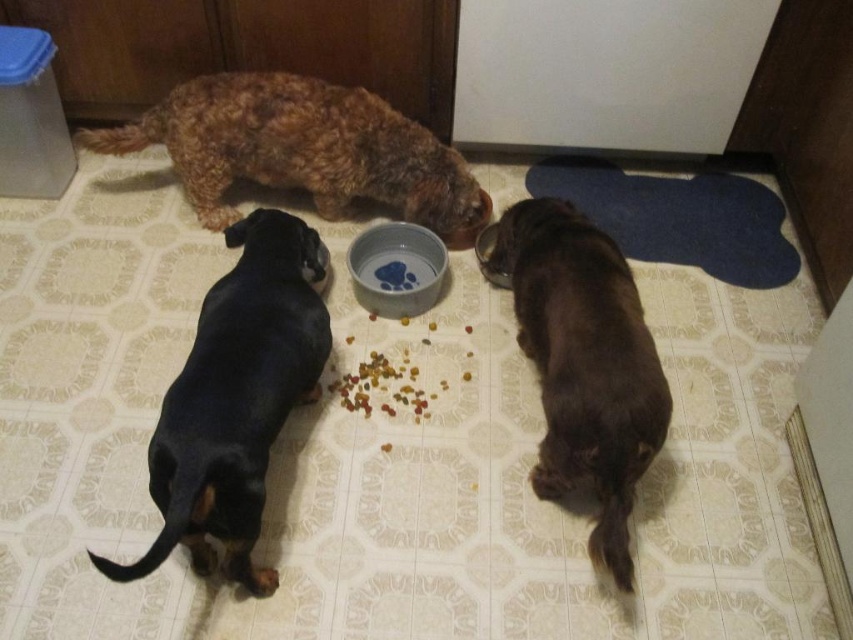
What is the 2D coordinate location of the black smooth dachshund at lower left in the image?

The 2D coordinate location of the black smooth dachshund at lower left is at point (x=235, y=400).

Looking at this image, you are a pet owner who wants to place a new toy for the brown furry dog at lower right. The toy needs to be placed in a spot that is not directly under the metallic silver bowl at center. Where should you place the toy?

The brown furry dog at lower right is located below the metallic silver bowl at center. To place the toy not directly under the bowl, you should position it either to the left, right, or above the metallic silver bowl at center.